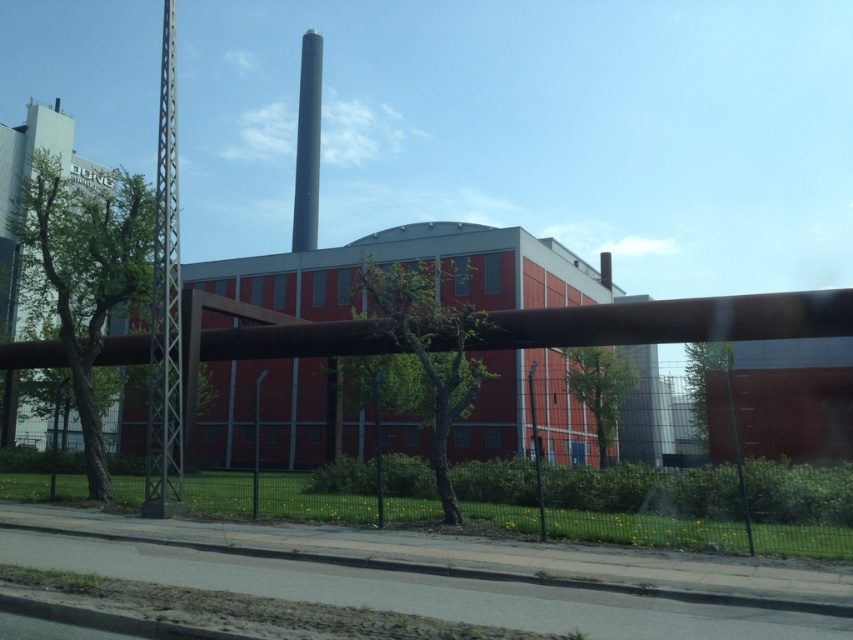
Question: Is green grass at lower center positioned behind smooth gray chimney at upper center?

Choices:
 (A) yes
 (B) no

Answer: (B)

Question: Which point is farther to the camera?

Choices:
 (A) (315, 221)
 (B) (828, 497)

Answer: (A)

Question: Is green grass at lower center positioned at the back of smooth gray chimney at upper center?

Choices:
 (A) no
 (B) yes

Answer: (A)

Question: Observing the image, what is the correct spatial positioning of green grass at lower center in reference to smooth gray chimney at upper center?

Choices:
 (A) left
 (B) right

Answer: (B)

Question: Which object is farther from the camera taking this photo?

Choices:
 (A) green grass at lower center
 (B) smooth gray chimney at upper center

Answer: (B)